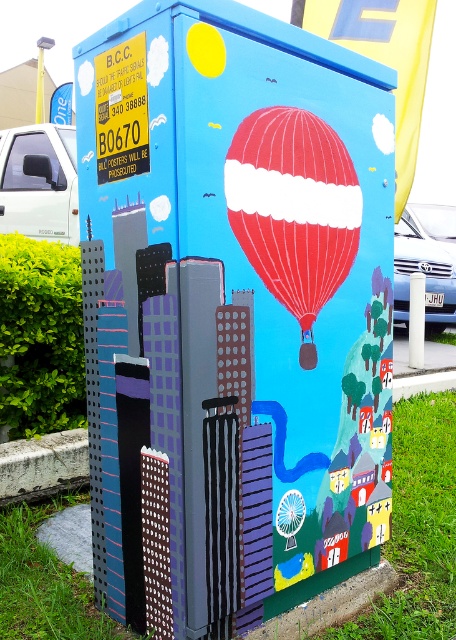
Is matte blue building at center smaller than red glossy hot air balloon at center?

Actually, matte blue building at center might be larger than red glossy hot air balloon at center.

Who is shorter, matte blue building at center or red glossy hot air balloon at center?

red glossy hot air balloon at center is shorter.

Find the location of a particular element. matte blue building at center is located at coordinates (236, 307).